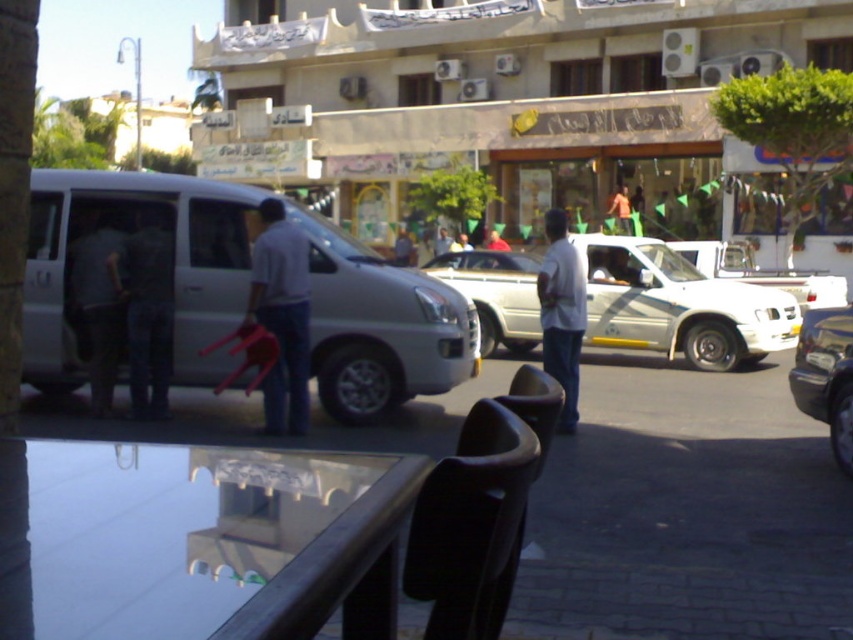
You are a delivery person who needs to park your van in the parking lot. The parking spot is at the point with coordinates [128,230]. Can you safely park your van there without blocking the entrance to the building?

The point [128,230] indicates the white matte van at left, so the parking spot is already occupied by the van. Therefore, you cannot park there without blocking the entrance.

In the scene shown: You are a delivery person trying to navigate through the street scene. There are two points marked in the image. The first point is at coordinate point(215, 241) and the second point is at point(155, 285). Which point is closer to the van parked in the midground?

Point(155, 285) is closer to the van parked in the midground because it is in front of point(215, 241), which is behind it.